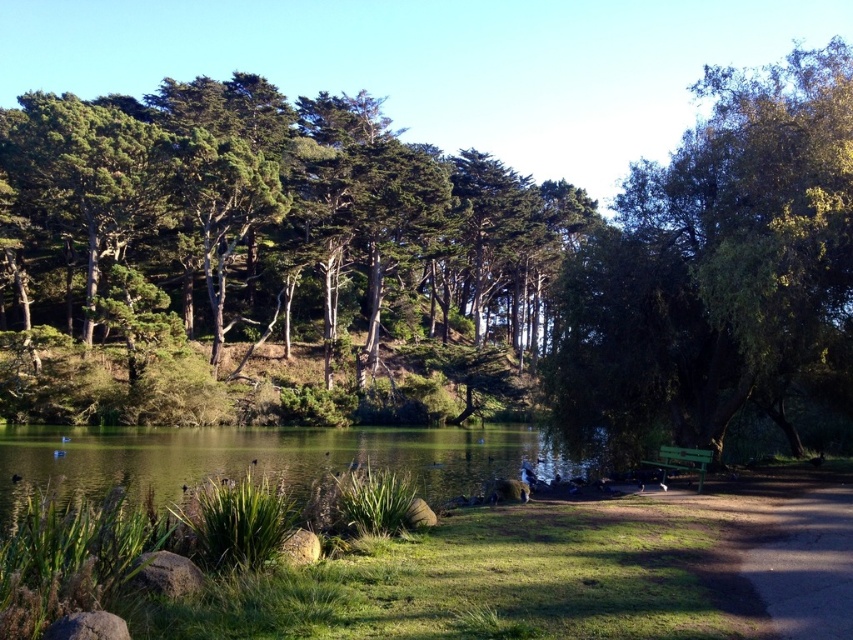
Question: Can you confirm if green textured trees at upper left is wider than green reflective water at center?

Choices:
 (A) no
 (B) yes

Answer: (B)

Question: Is green textured trees at upper left thinner than green reflective water at center?

Choices:
 (A) yes
 (B) no

Answer: (B)

Question: Estimate the real-world distances between objects in this image. Which object is farther from the green leafy tree at right?

Choices:
 (A) green textured trees at upper left
 (B) green painted wood bench at lower right

Answer: (A)

Question: Is dirt/gravel path at lower right wider than green painted wood bench at lower right?

Choices:
 (A) no
 (B) yes

Answer: (B)

Question: Estimate the real-world distances between objects in this image. Which object is farther from the green painted wood bench at lower right?

Choices:
 (A) green leafy tree at right
 (B) green textured trees at upper left

Answer: (B)

Question: Which object is closer to the camera taking this photo?

Choices:
 (A) green painted wood bench at lower right
 (B) dirt/gravel path at lower right
 (C) green leafy tree at right
 (D) green reflective water at center

Answer: (B)